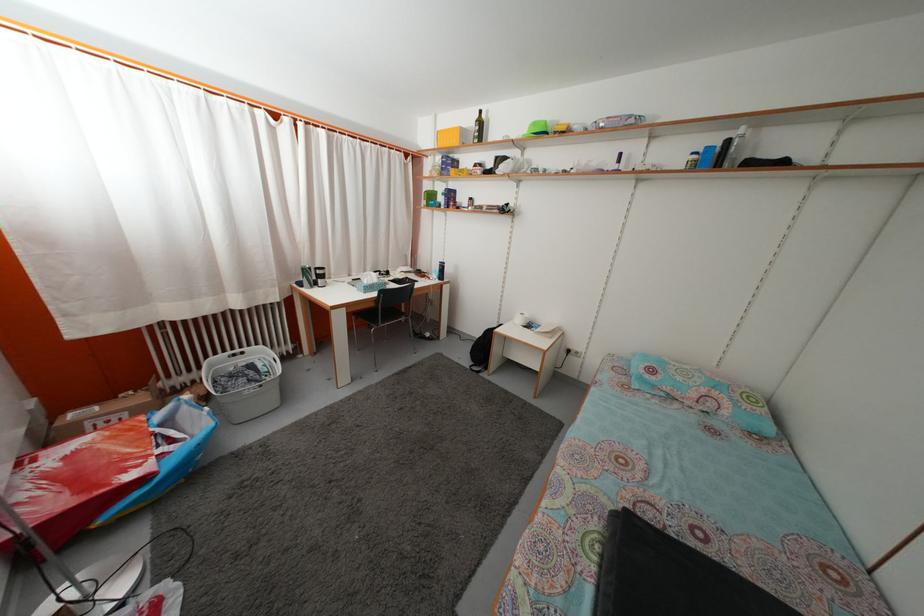
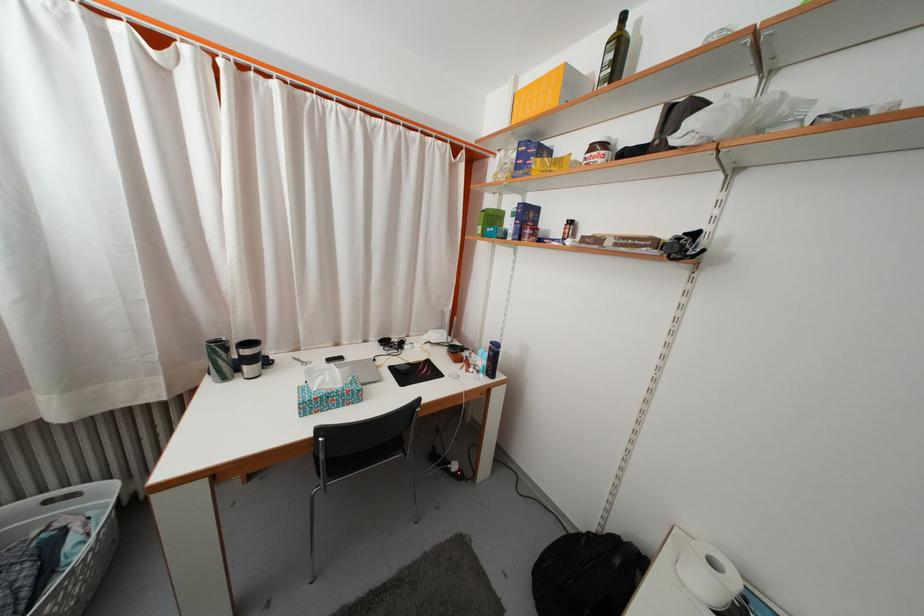
Find the pixel in the second image that matches point (324, 280) in the first image.

(251, 359)